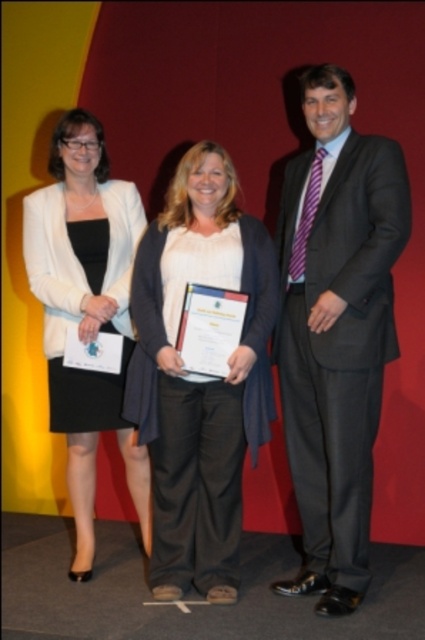
Which is more to the left, matte white sweater at center or matte white blazer at left?

matte white blazer at left

Is matte white sweater at center positioned before matte white blazer at left?

Yes, it is in front of matte white blazer at left.

The image size is (425, 640). I want to click on matte white sweater at center, so click(200, 376).

Which is below, dark gray suit at center or matte white sweater at center?

matte white sweater at center is below.

Which is behind, point (328, 372) or point (176, 422)?

Positioned behind is point (176, 422).

Is point (359, 408) positioned before point (231, 529)?

Yes.

This screenshot has height=640, width=425. Find the location of `dark gray suit at center`. dark gray suit at center is located at coordinates (337, 330).

Does dark gray suit at center appear on the left side of matte white blazer at left?

In fact, dark gray suit at center is to the right of matte white blazer at left.

Who is higher up, dark gray suit at center or matte white blazer at left?

dark gray suit at center

Where is `dark gray suit at center`? The image size is (425, 640). dark gray suit at center is located at coordinates (337, 330).

At what (x,y) coordinates should I click in order to perform the action: click on dark gray suit at center. Please return your answer as a coordinate pair (x, y). The height and width of the screenshot is (640, 425). Looking at the image, I should click on (337, 330).